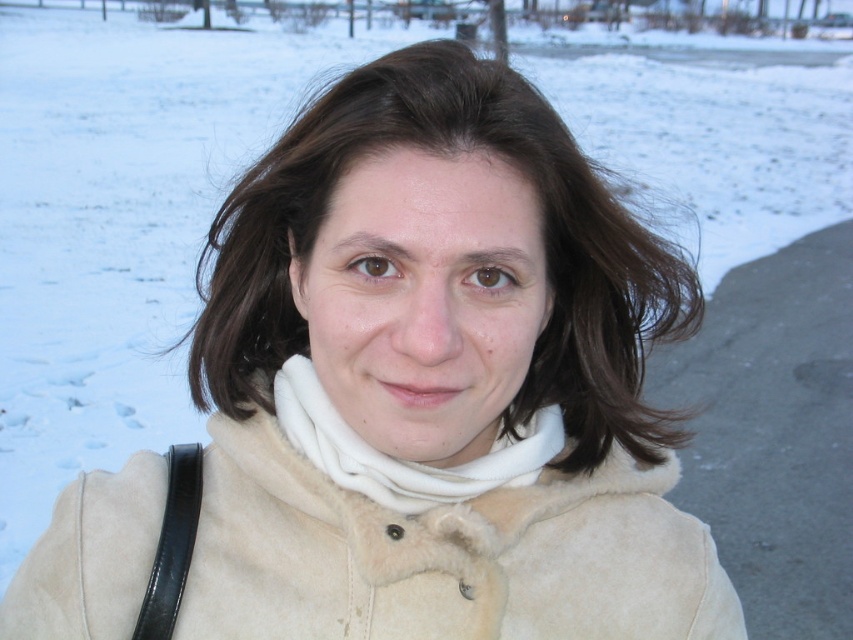
You are a fashion designer observing the image of a person wearing a beige suede coat at center and having brownwoollyhair at center. Which item takes up more space in the image?

The brownwoollyhair at center takes up more space in the image than the beige suede coat at center because the beige suede coat at center is smaller than brownwoollyhair at center.

You are a fashion designer observing the image. You need to determine the arrangement of the beige suede coat at center and brownwoollyhair at center. Which one is located closer to the bottom of the image?

The beige suede coat at center is positioned under brownwoollyhair at center, meaning the beige suede coat at center is closer to the bottom of the image.